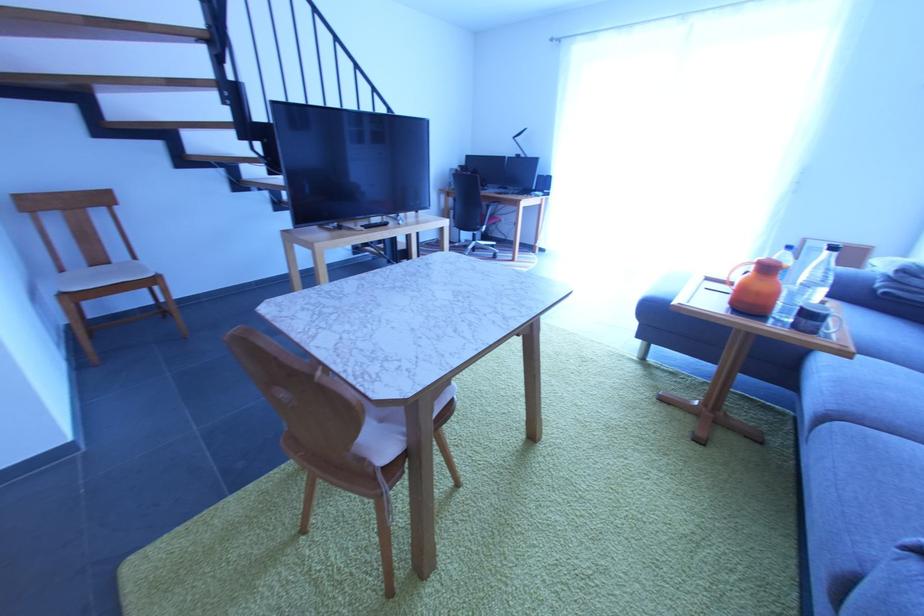
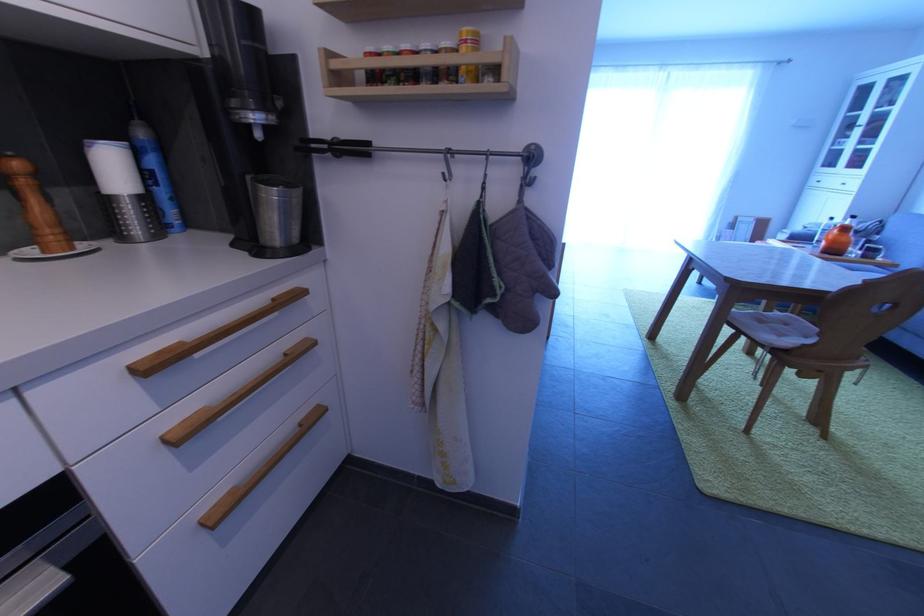
Question: Which direction would the cameraman need to move to produce the second image? Reply with the corresponding letter.

Choices:
 (A) Left
 (B) Right
 (C) Forward
 (D) Backward

Answer: (A)